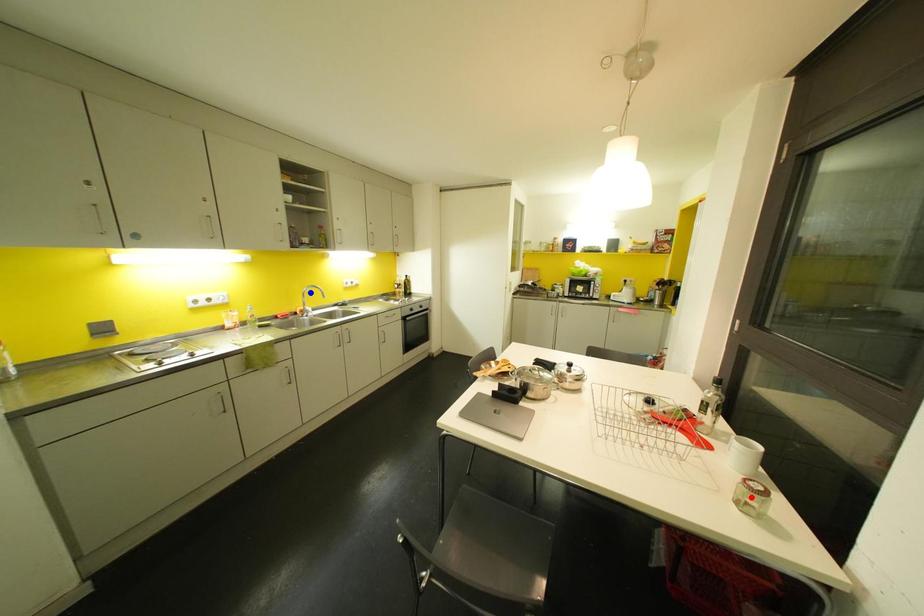
Question: Two points are marked on the image. Which point is closer to the camera?

Choices:
 (A) Blue point is closer.
 (B) Red point is closer.

Answer: (B)